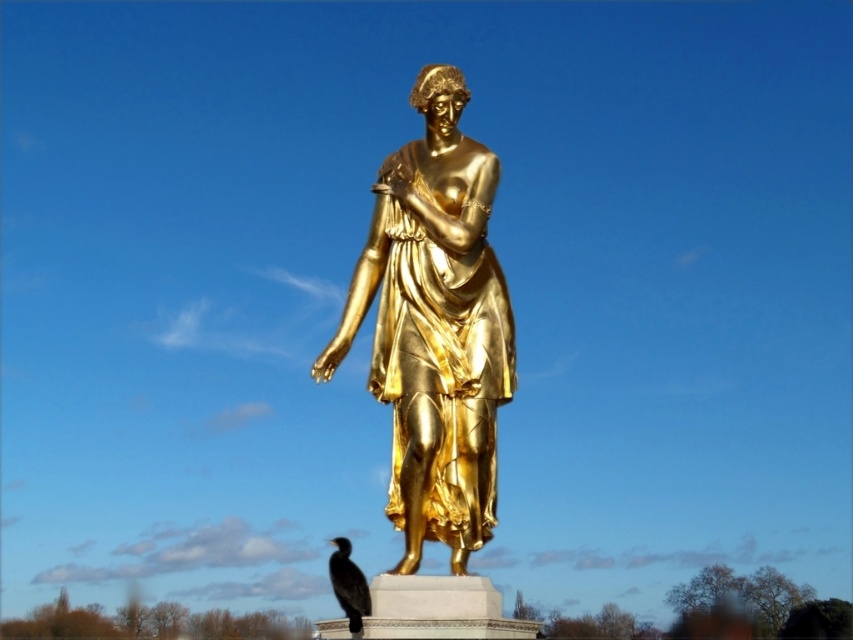
You are an art conservator assessing the placement of the gold polished statue at center and the black feathered bird at lower center. Based on the statue and bird positions, which object is closer to the viewer?

The black feathered bird at lower center is closer to the viewer since the gold polished statue at center is positioned to its right side, meaning it is further away in the scene.

You are a park maintenance worker who needs to clean the area around the gold polished statue at center and the black feathered bird at lower center. The cleaning equipment you have can only reach up to 14 meters. Can you clean both objects without moving the equipment?

The gold polished statue at center is 14.23 meters from the black feathered bird at lower center. Since the equipment can only reach up to 14 meters, you cannot clean both objects without moving the equipment because the distance between them exceeds the equipment range.

You are standing in front of the golden statue on the pedestal and notice two points marked on the pedestal. One is at coordinates point (451, 195) and the other at point (363, 586). From your perspective, which point is closer to you?

Point (363, 586) is closer to you because it is in front of point (451, 195) according to their spatial arrangement.